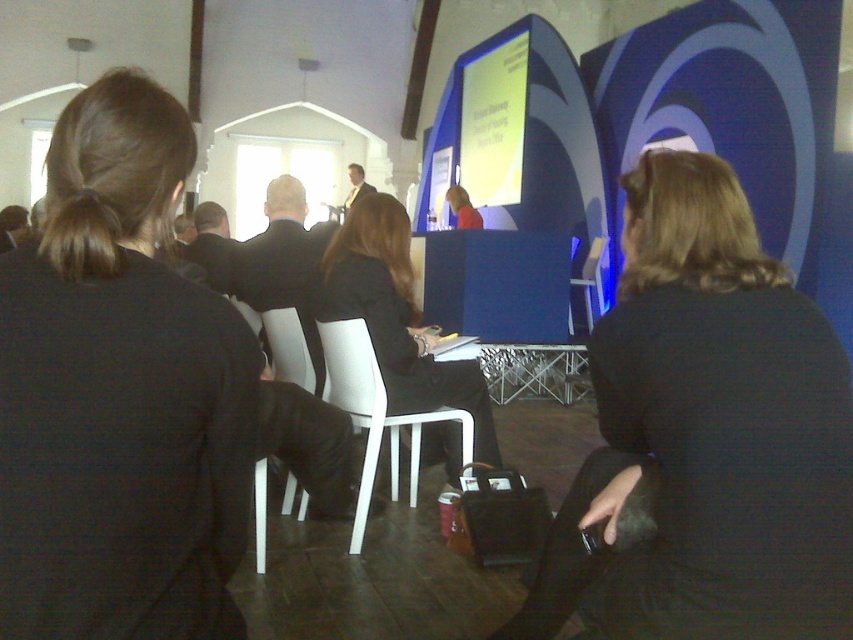
You are an event organizer who needs to identify the correct jacket to hand to the presenter. The presenter mentioned they are wearing a jacket that is positioned higher up on the stage. Which jacket should you choose between the black fabric jacket at center and the matte black jacket at center?

The matte black jacket at center is positioned higher up on the stage, so you should choose the matte black jacket at center.

You are an event organizer checking the seating arrangement. You notice the dark blue fabric jacket at center and the white plastic chair at center. Which object is covering the other?

The dark blue fabric jacket at center is positioned over the white plastic chair at center, so the jacket is covering the chair.